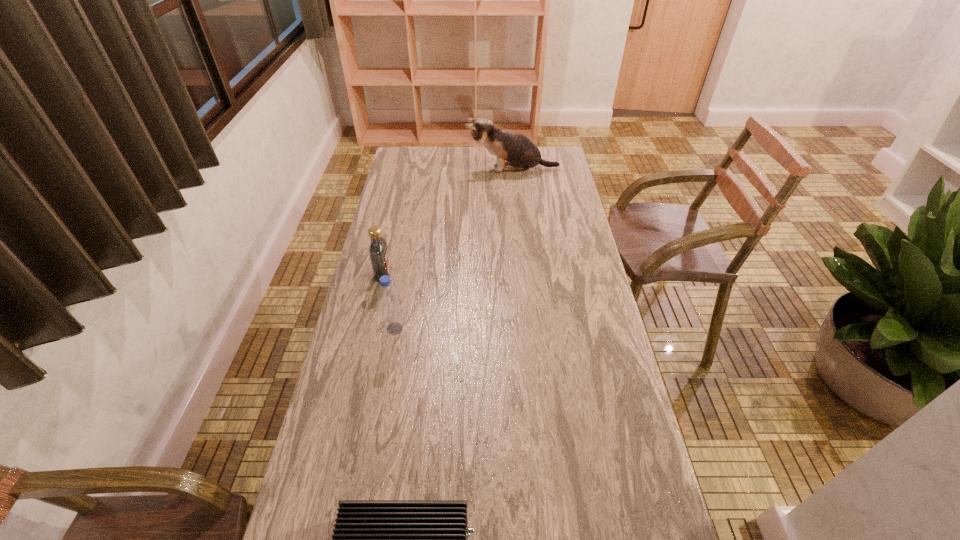
Identify the location of bottle that is at the left edge. (388, 297).

Locate an element on the screen. vodka that is at the left edge is located at coordinates (378, 250).

The width and height of the screenshot is (960, 540). I want to click on object at the right edge, so click(520, 153).

Find the location of `object present at the far right corner`. object present at the far right corner is located at coordinates coord(520,153).

Identify the location of vacant space at the far edge. This screenshot has width=960, height=540. (484, 168).

In the image, there is a desktop. Where is `vacant region at the left edge`? Image resolution: width=960 pixels, height=540 pixels. vacant region at the left edge is located at coordinates (420, 192).

This screenshot has height=540, width=960. Identify the location of vacant space at the right edge of the desktop. (587, 345).

Locate an element on the screen. The width and height of the screenshot is (960, 540). vacant area that lies between the vodka and the farthest object is located at coordinates (447, 221).

The width and height of the screenshot is (960, 540). I want to click on empty location between the leftmost object and the farthest object, so click(x=447, y=221).

At what (x,y) coordinates should I click in order to perform the action: click on vacant area that lies between the cat and the bottle. Please return your answer as a coordinate pair (x, y). The image size is (960, 540). Looking at the image, I should click on (453, 249).